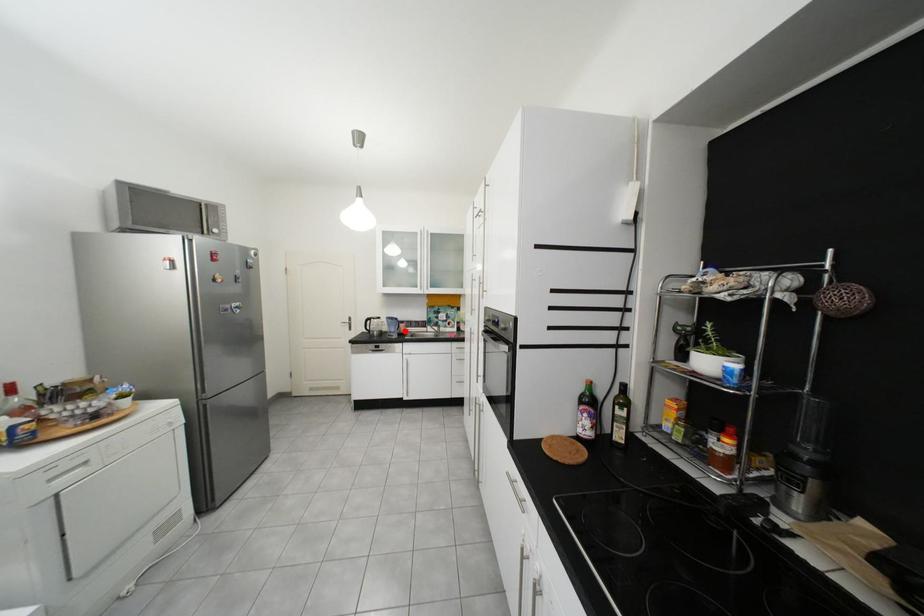
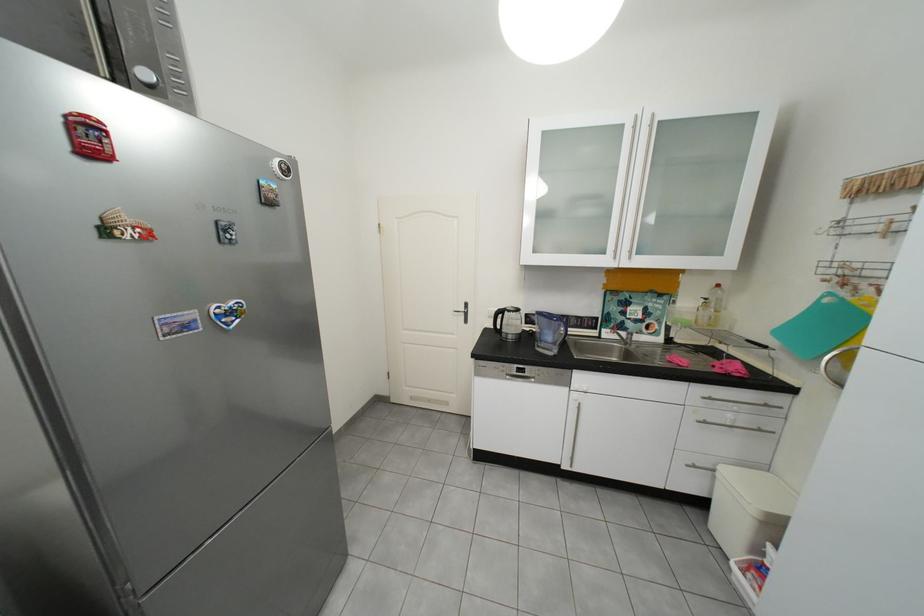
The point at the highlighted location is marked in the first image. Where is the corresponding point in the second image?

(561, 339)